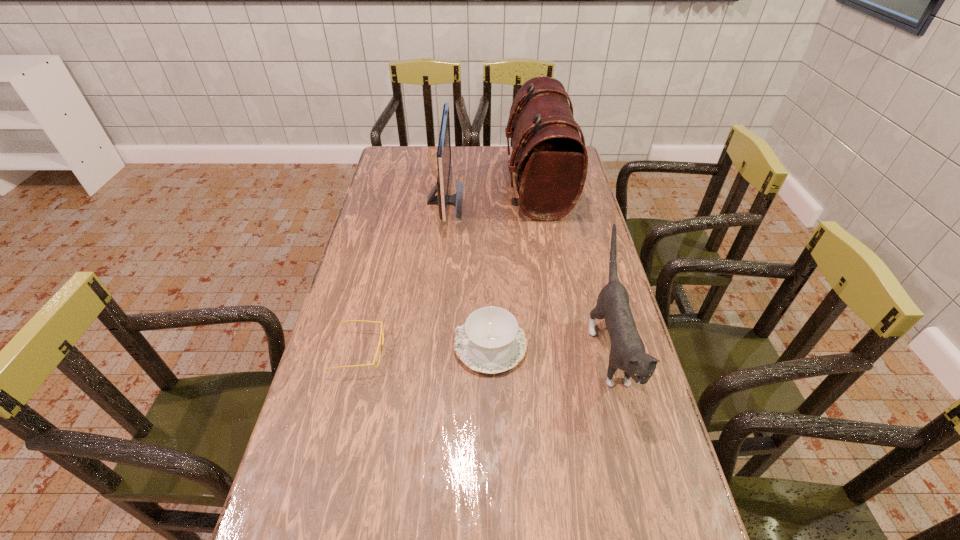
I want to click on free space between the shortest object and the satchel, so 448,268.

You are a GUI agent. You are given a task and a screenshot of the screen. Output one action in this format:
    pyautogui.click(x=<x>, y=<y>)
    Task: Click on the unoccupied position between the monitor and the cat
    This screenshot has height=540, width=960.
    Given the screenshot: What is the action you would take?
    pyautogui.click(x=527, y=276)

You are a GUI agent. You are given a task and a screenshot of the screen. Output one action in this format:
    pyautogui.click(x=<x>, y=<y>)
    Task: Click on the free spot between the fourth tallest object and the monitor
    Image resolution: width=960 pixels, height=540 pixels.
    Given the screenshot: What is the action you would take?
    pyautogui.click(x=468, y=273)

You are a GUI agent. You are given a task and a screenshot of the screen. Output one action in this format:
    pyautogui.click(x=<x>, y=<y>)
    Task: Click on the free spot between the chinaware and the spectacles
    This screenshot has width=960, height=540.
    Given the screenshot: What is the action you would take?
    pyautogui.click(x=424, y=348)

Find the location of a particular element. The width and height of the screenshot is (960, 540). vacant area that lies between the leftmost object and the chinaware is located at coordinates (424, 348).

You are a GUI agent. You are given a task and a screenshot of the screen. Output one action in this format:
    pyautogui.click(x=<x>, y=<y>)
    Task: Click on the object that is the fourth nearest to the shortest object
    The height and width of the screenshot is (540, 960).
    Given the screenshot: What is the action you would take?
    pyautogui.click(x=549, y=158)

Identify which object is the closest to the spectacles. Please provide its 2D coordinates. Your answer should be formatted as a tuple, i.e. [(x, y)], where the tuple contains the x and y coordinates of a point satisfying the conditions above.

[(491, 341)]

This screenshot has width=960, height=540. I want to click on vacant point that satisfies the following two spatial constraints: 1. at the face of the cat; 2. in front of the lenses of the shortest object, so click(611, 352).

Find the location of `free spot that satisfies the following two spatial constraints: 1. at the face of the cat; 2. in front of the lenses of the leftmost object`. free spot that satisfies the following two spatial constraints: 1. at the face of the cat; 2. in front of the lenses of the leftmost object is located at coordinates (611, 352).

The image size is (960, 540). I want to click on free location that satisfies the following two spatial constraints: 1. at the face of the cat; 2. in front of the lenses of the shortest object, so click(x=611, y=352).